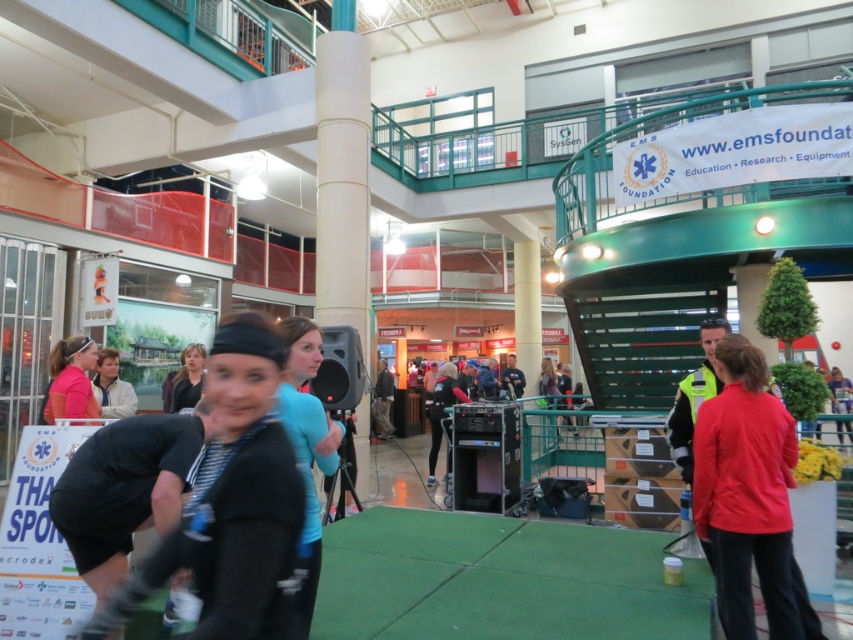
Question: Which object is positioned farthest from the light blue shirt at center?

Choices:
 (A) red matte jacket at center
 (B) black matte headband at center
 (C) pink fabric headband at upper left

Answer: (A)

Question: Which object is farther from the camera taking this photo?

Choices:
 (A) light blue shirt at center
 (B) pink fabric headband at upper left
 (C) black matte headband at center
 (D) red matte jacket at center

Answer: (A)

Question: Does red matte jacket at center have a larger size compared to pink fabric headband at upper left?

Choices:
 (A) yes
 (B) no

Answer: (A)

Question: Is red matte jacket at center positioned in front of light blue shirt at center?

Choices:
 (A) yes
 (B) no

Answer: (A)

Question: Estimate the real-world distances between objects in this image. Which object is closer to the black matte headband at center?

Choices:
 (A) red matte jacket at center
 (B) pink fabric headband at upper left

Answer: (A)

Question: Is black matte headband at center further to camera compared to pink fabric headband at upper left?

Choices:
 (A) no
 (B) yes

Answer: (A)